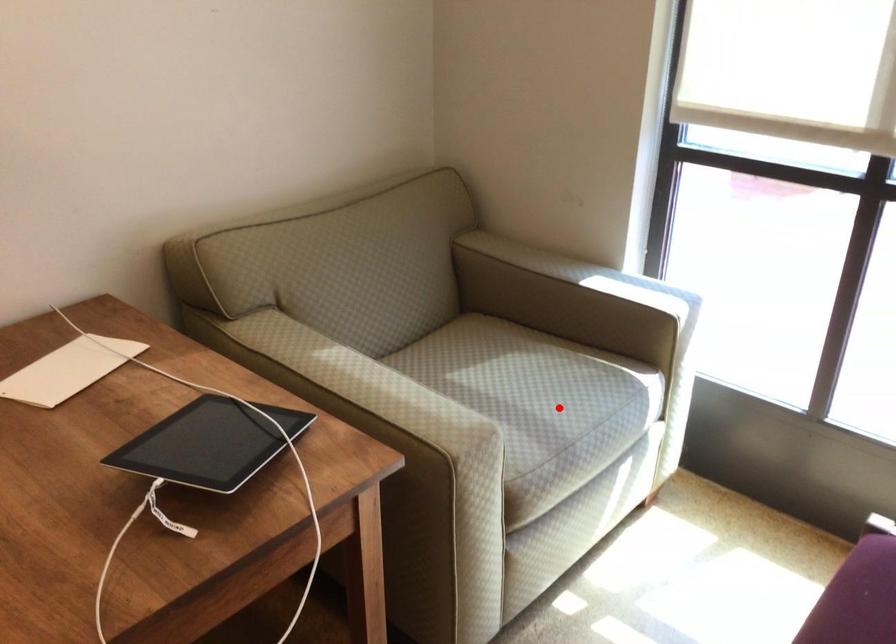
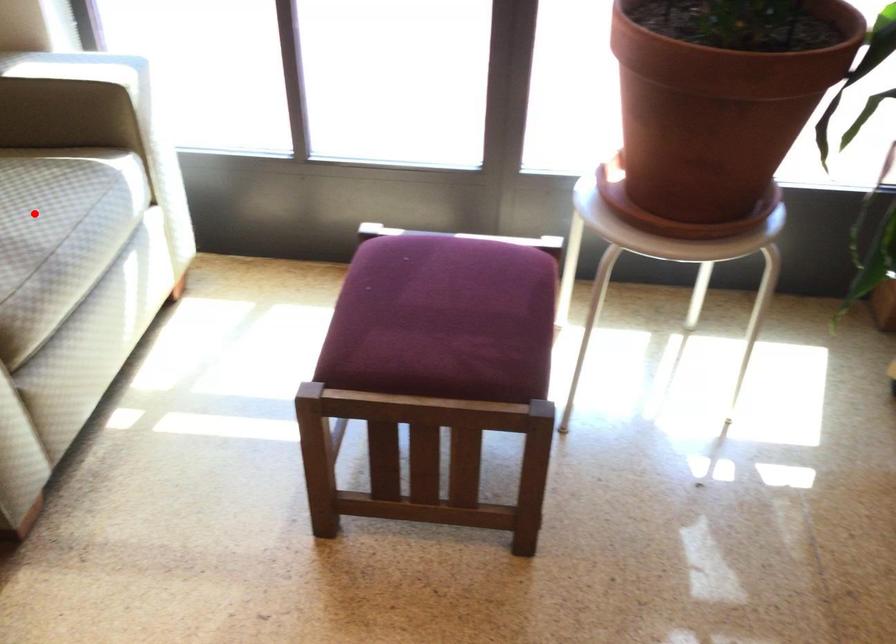
I am providing you with two images of the same scene from different viewpoints. A red point is marked on the first image and another point is marked on the second image. Do the highlighted points in image1 and image2 indicate the same real-world spot?

Yes